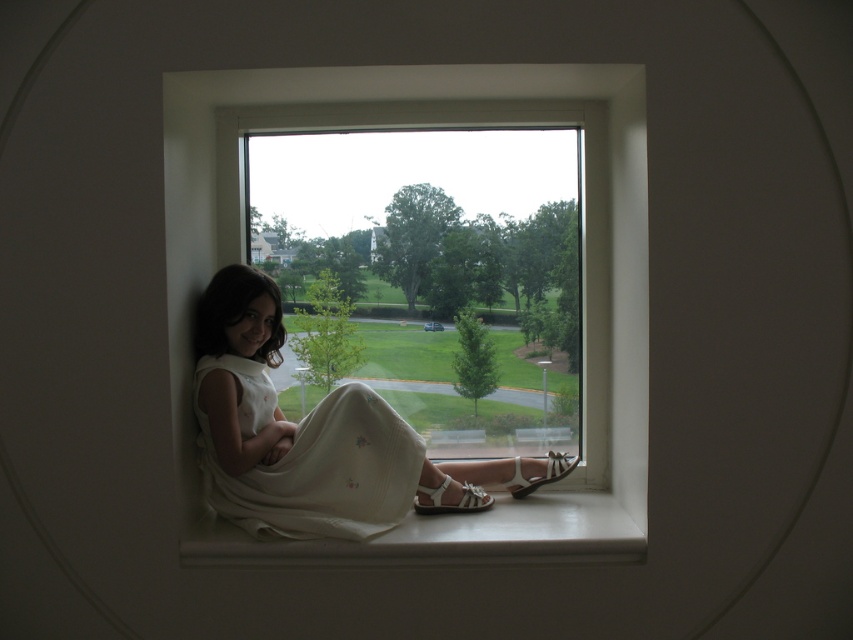
Identify the location of white plastic window at center. This screenshot has height=640, width=853. (583, 266).

Can you confirm if white plastic window at center is bigger than white fabric sandal at lower center?

Correct, white plastic window at center is larger in size than white fabric sandal at lower center.

Which is above, white plastic window at center or white fabric sandal at lower center?

Positioned higher is white plastic window at center.

Does point (630, 262) come in front of point (415, 500)?

Yes, point (630, 262) is closer to viewer.

Find the location of a particular element. This screenshot has width=853, height=640. white plastic window at center is located at coordinates (583, 266).

Who is positioned more to the right, white cotton dress at lower center or white smooth window sill at lower center?

From the viewer's perspective, white smooth window sill at lower center appears more on the right side.

Who is positioned more to the left, white cotton dress at lower center or white smooth window sill at lower center?

white cotton dress at lower center

Locate an element on the screen. The height and width of the screenshot is (640, 853). white cotton dress at lower center is located at coordinates (300, 433).